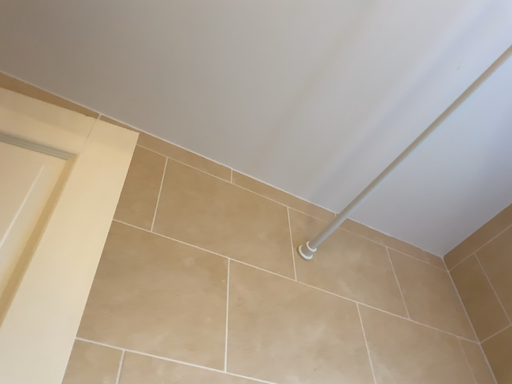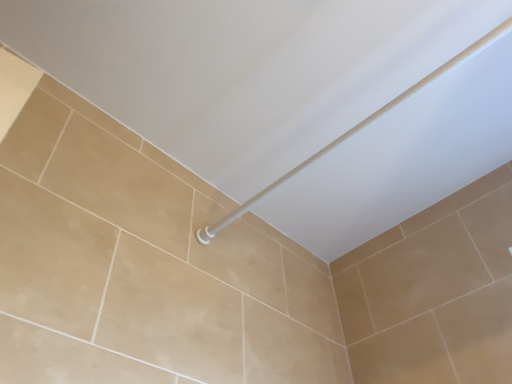
Question: How did the camera likely rotate when shooting the video?

Choices:
 (A) rotated right
 (B) rotated left

Answer: (A)